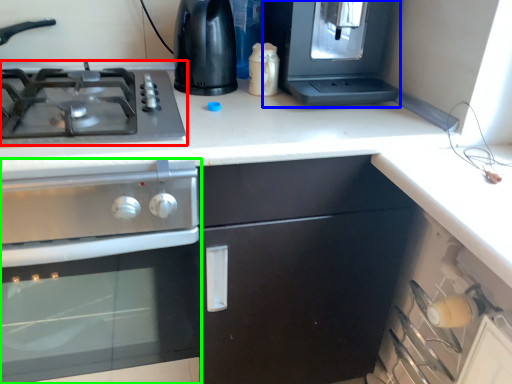
Question: Estimate the real-world distances between objects in this image. Which object is farther from gas stove (highlighted by a red box), appliance (highlighted by a blue box) or kitchen appliance (highlighted by a green box)?

Choices:
 (A) appliance
 (B) kitchen appliance

Answer: (A)